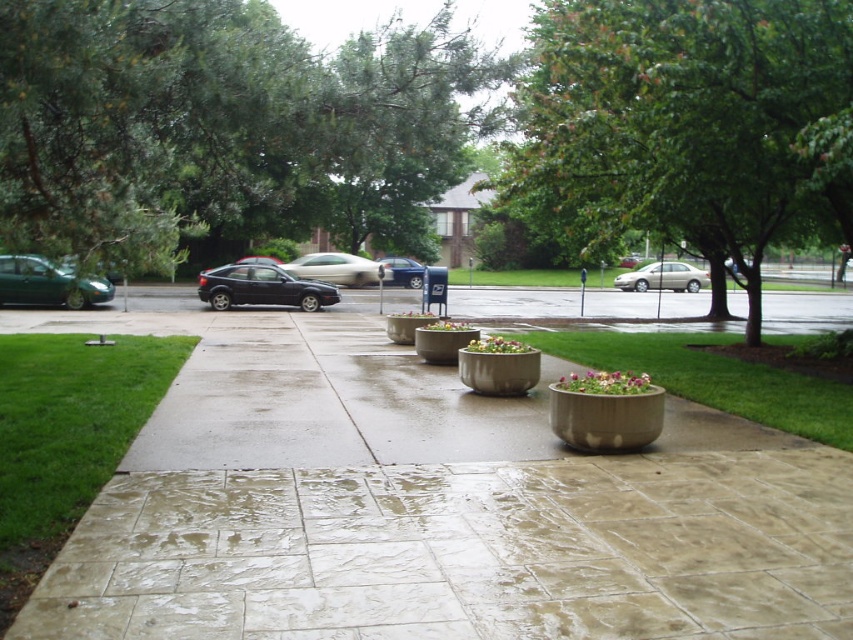
Is green matte car at left above purple matte flower pot at center?

Yes, green matte car at left is above purple matte flower pot at center.

Which is in front, point (70, 301) or point (601, 380)?

Point (601, 380) is more forward.

I want to click on green matte car at left, so click(x=48, y=284).

Is point (302, 307) less distant than point (514, 339)?

No, it is behind (514, 339).

In order to click on satin black hatchback at center in this screenshot , I will do pos(262,288).

Where is `satin black hatchback at center`? satin black hatchback at center is located at coordinates (262, 288).

Can you confirm if green leafy tree at upper left is positioned to the left of green matte flower pot at center?

Correct, you'll find green leafy tree at upper left to the left of green matte flower pot at center.

Who is more forward, (448, 28) or (451, 328)?

Point (448, 28)

Is point (74, 216) farther from viewer compared to point (451, 324)?

That is False.

Where is `green leafy tree at upper left`? The width and height of the screenshot is (853, 640). green leafy tree at upper left is located at coordinates (223, 128).